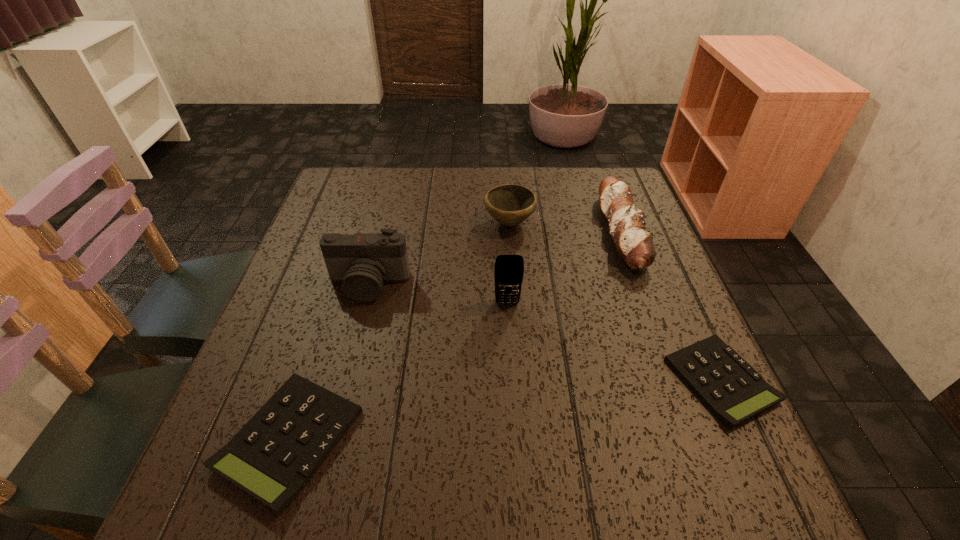
I want to click on vacant area between the camera and the left calculator, so (329, 362).

This screenshot has height=540, width=960. In order to click on free space between the baguet and the camera in this screenshot , I will do `click(495, 258)`.

The height and width of the screenshot is (540, 960). I want to click on empty location between the camera and the right calculator, so click(544, 333).

At what (x,y) coordinates should I click in order to perform the action: click on free point between the taller calculator and the camera. Please return your answer as a coordinate pair (x, y). This screenshot has height=540, width=960. Looking at the image, I should click on (329, 362).

Find the location of a particular element. This screenshot has width=960, height=540. unoccupied area between the bowl and the fifth tallest object is located at coordinates (399, 331).

The height and width of the screenshot is (540, 960). I want to click on vacant area between the shortest object and the taller calculator, so click(x=505, y=410).

In order to click on free spot between the baguet and the second shortest object in this screenshot , I will do `click(456, 335)`.

Locate an element on the screen. This screenshot has width=960, height=540. free space that is in between the taller calculator and the cellular telephone is located at coordinates click(398, 372).

Point out which object is positioned as the fifth nearest to the left calculator. Please provide its 2D coordinates. Your answer should be formatted as a tuple, i.e. [(x, y)], where the tuple contains the x and y coordinates of a point satisfying the conditions above.

[(626, 223)]

Where is `object that can be found as the third closest to the right calculator`? object that can be found as the third closest to the right calculator is located at coordinates 510,204.